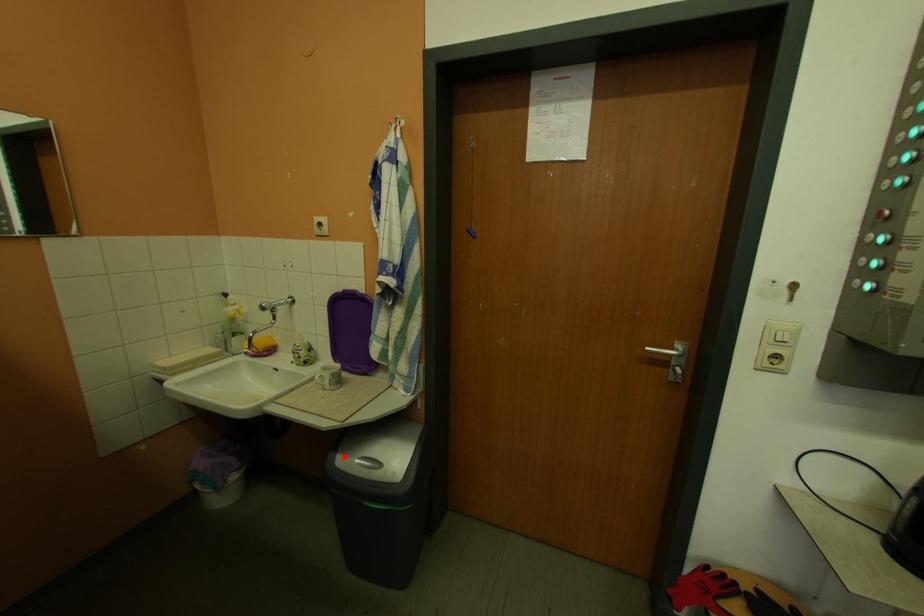
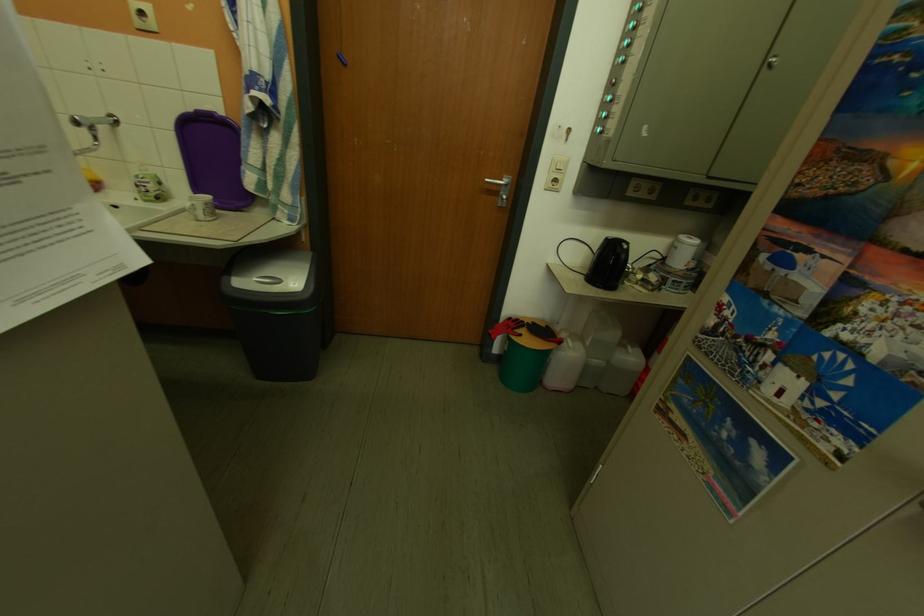
Question: A red point is marked in image1. In image2, is the corresponding 3D point closer to the camera or farther? Reply with the corresponding letter.

Choices:
 (A) The corresponding 3D point is closer.
 (B) The corresponding 3D point is farther.

Answer: (A)